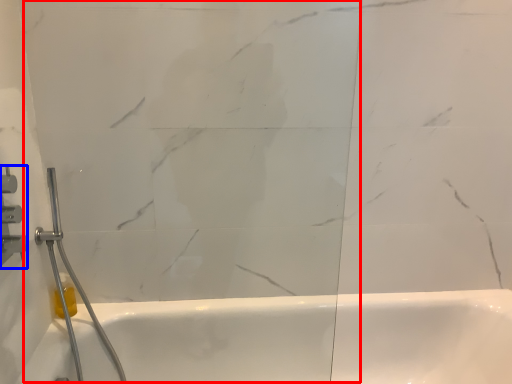
Question: Which point is closer to the camera, glass door (highlighted by a red box) or shower (highlighted by a blue box)?

Choices:
 (A) glass door
 (B) shower

Answer: (A)